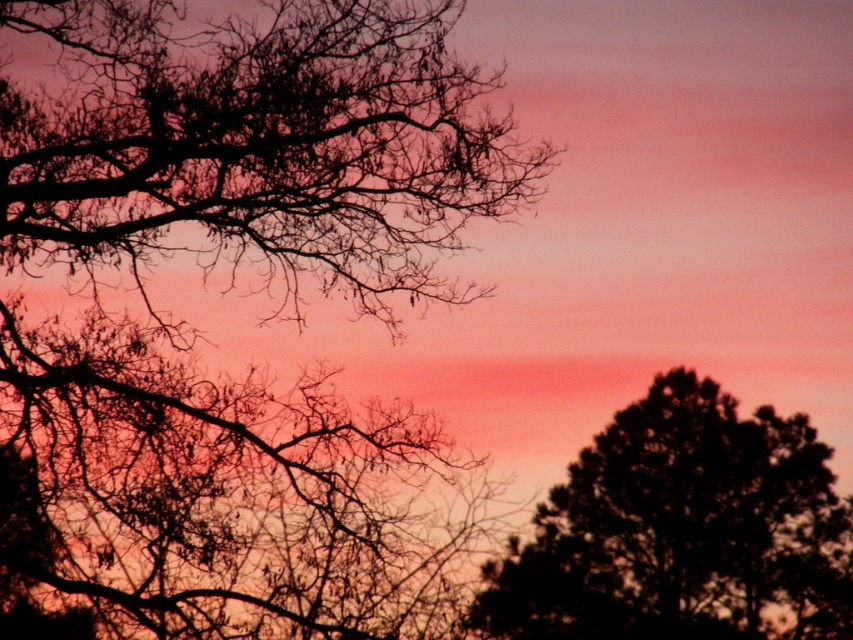
Where is the silhouette tree at upper left located in the image?

The silhouette tree at upper left is located at point (x=234, y=285).

You are an artist trying to paint the sunset scene. You want to ensure the silhouette tree at upper left and the dark green textured tree at right are placed correctly. Based on the scene description, which tree should be drawn higher up in the painting?

The silhouette tree at upper left should be drawn higher up in the painting because it is positioned over the dark green textured tree at right.

You are standing in front of the sunset scene and want to take a photo. You notice two points in the image labeled as point (96, 202) and point (796, 593). Which point is closer to your camera?

Point (96, 202) is closer to the camera than point (796, 593).